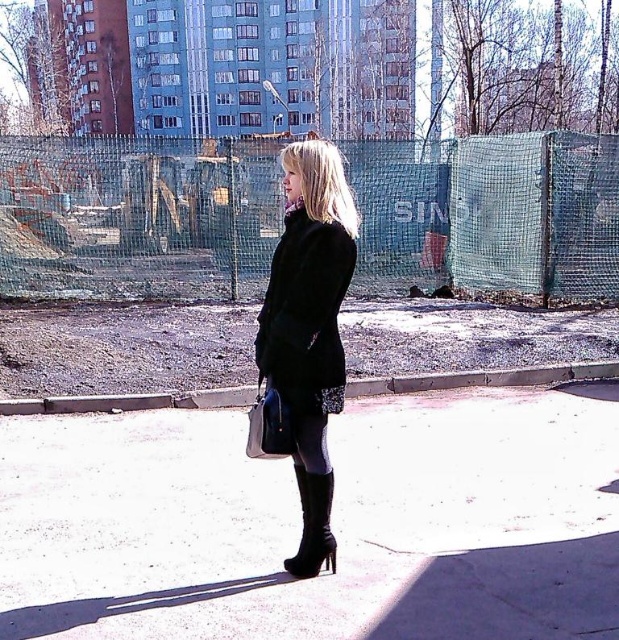
You are a fashion designer observing the woman in the scene. You need to determine the spatial relationship between her black leather coat at center and her black leather boot at lower center. Which object is positioned closer to you?

The black leather coat at center is closer to the viewer than the black leather boot at lower center.

You are a fashion designer observing the woman in the urban scene. You need to determine the spatial relationship between her black leather coat at center and her black leather boot at lower center. Which object is located above the other?

The black leather coat at center is positioned over black leather boot at lower center, meaning the coat is above the boot.

You are a delivery person trying to navigate through the construction site fence. You see the black leather boots at center and the black leather boot at lower center in the image. Which boot is closer to the fence?

The black leather boot at lower center is closer to the fence because it is positioned lower in the image, which typically indicates proximity in such scenes.